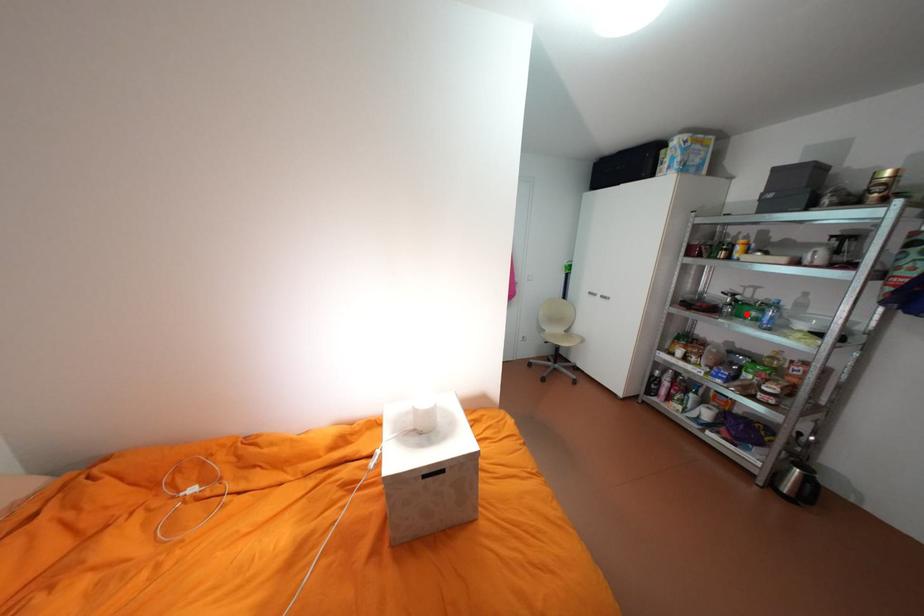
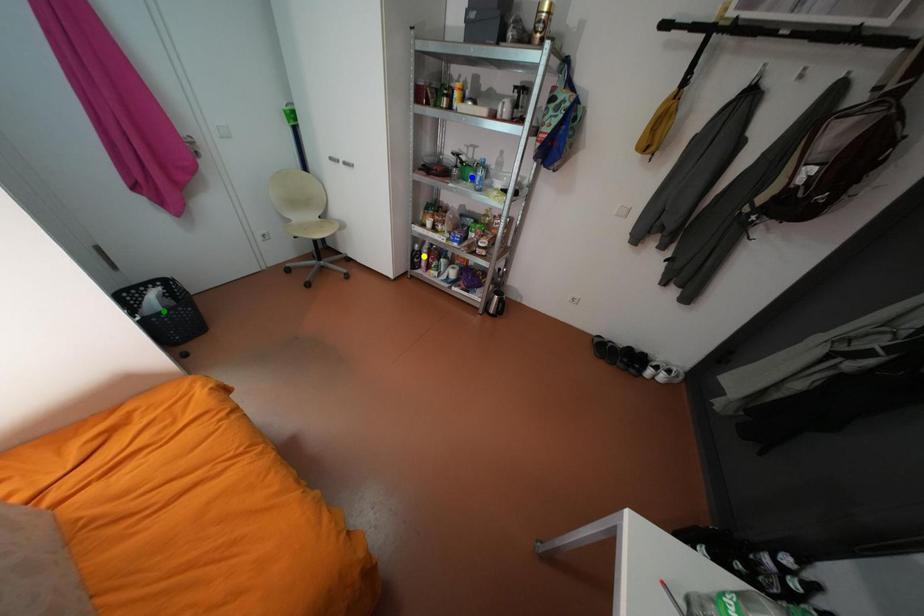
Question: I am providing you with two images of the same scene from different viewpoints. A red point is marked on the first image. You are given multiple points on the second image. Which point in image 2 is actually the same real-world point as the red point in image 1?

Choices:
 (A) green point
 (B) yellow point
 (C) blue point

Answer: (C)